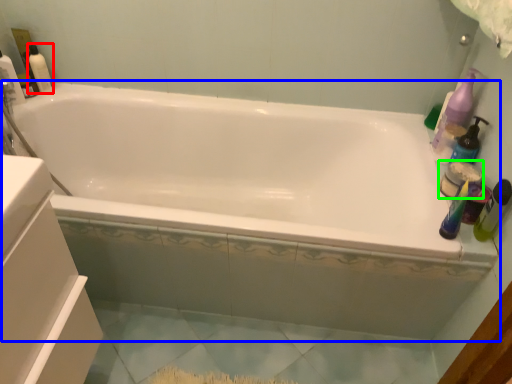
Question: Considering the real-world distances, which object is closest to cleaning product (highlighted by a red box)? bathtub (highlighted by a blue box) or toiletry (highlighted by a green box).

Choices:
 (A) bathtub
 (B) toiletry

Answer: (A)